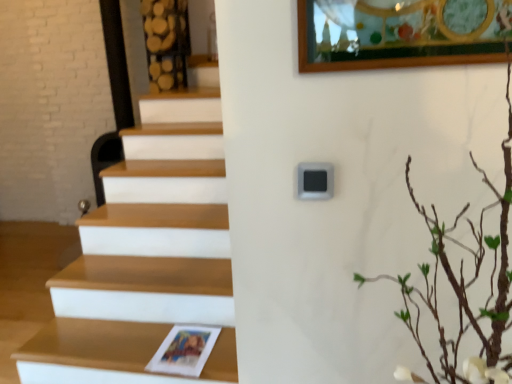
Question: Can you confirm if green leafy branches at upper right is bigger than wooden at lower left?

Choices:
 (A) yes
 (B) no

Answer: (A)

Question: From a real-world perspective, is green leafy branches at upper right below wooden at lower left?

Choices:
 (A) yes
 (B) no

Answer: (B)

Question: From a real-world perspective, is green leafy branches at upper right physically above wooden at lower left?

Choices:
 (A) no
 (B) yes

Answer: (B)

Question: Can you confirm if green leafy branches at upper right is positioned to the right of wooden at lower left?

Choices:
 (A) yes
 (B) no

Answer: (A)

Question: Can you see green leafy branches at upper right touching wooden at lower left?

Choices:
 (A) no
 (B) yes

Answer: (A)

Question: Does green leafy branches at upper right turn towards wooden at lower left?

Choices:
 (A) yes
 (B) no

Answer: (B)

Question: From a real-world perspective, is wooden at lower left positioned over green leafy branches at upper right based on gravity?

Choices:
 (A) no
 (B) yes

Answer: (A)

Question: Is wooden at lower left shorter than green leafy branches at upper right?

Choices:
 (A) no
 (B) yes

Answer: (B)

Question: Does wooden at lower left have a larger size compared to green leafy branches at upper right?

Choices:
 (A) yes
 (B) no

Answer: (B)

Question: Does wooden at lower left appear on the left side of green leafy branches at upper right?

Choices:
 (A) no
 (B) yes

Answer: (B)

Question: Is green leafy branches at upper right completely or partially inside wooden at lower left?

Choices:
 (A) yes
 (B) no

Answer: (B)

Question: Could you tell me if wooden at lower left is turned towards green leafy branches at upper right?

Choices:
 (A) no
 (B) yes

Answer: (A)

Question: Is wooden at lower left situated inside green leafy branches at upper right or outside?

Choices:
 (A) inside
 (B) outside

Answer: (B)